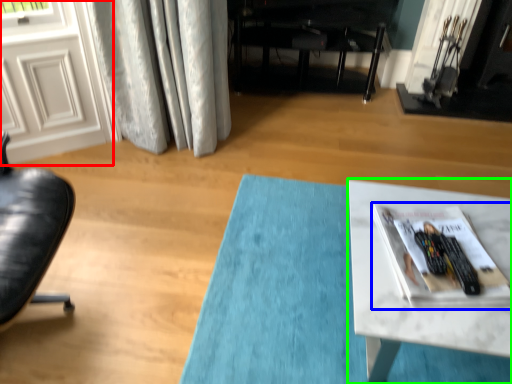
Question: Which is farther away from screen door (highlighted by a red box)? magazine (highlighted by a blue box) or table (highlighted by a green box)?

Choices:
 (A) magazine
 (B) table

Answer: (A)